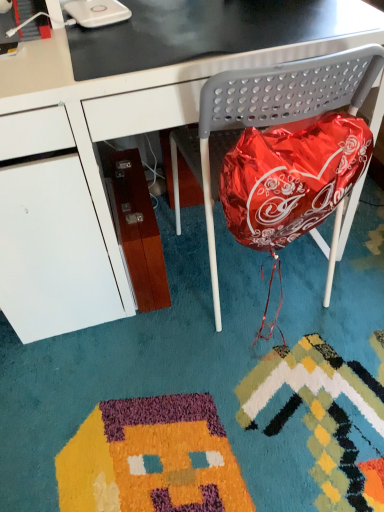
Question: From a real-world perspective, is black glossy desk at center physically located above or below metallic gray folding chair at center?

Choices:
 (A) above
 (B) below

Answer: (A)

Question: In terms of size, does black glossy desk at center appear bigger or smaller than metallic gray folding chair at center?

Choices:
 (A) small
 (B) big

Answer: (B)

Question: Considering the real-world distances, which object is closest to the black glossy table at upper center?

Choices:
 (A) metallic gray folding chair at center
 (B) black glossy desk at center

Answer: (B)

Question: Which is nearer to the black glossy table at upper center?

Choices:
 (A) metallic gray folding chair at center
 (B) black glossy desk at center

Answer: (B)